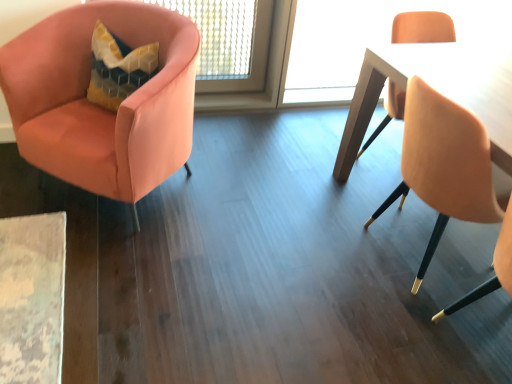
Locate an element on the screen. The image size is (512, 384). free space to the left of matte gold chair at right, which appears as the second chair when viewed from the left is located at coordinates (310, 262).